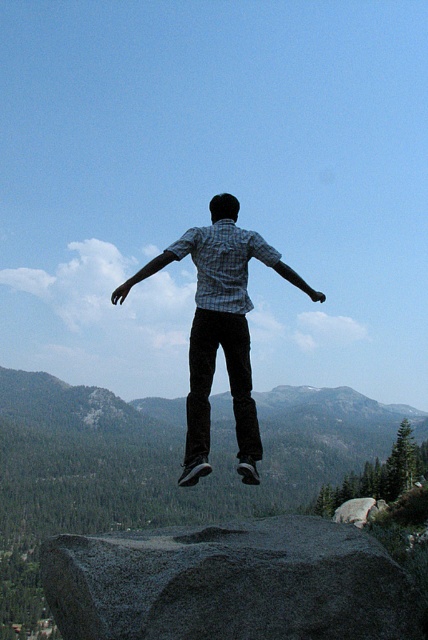
Looking at this image, you are a photographer aiming to capture the person midair. Based on the scene, which object is positioned closer to your camera lens when focusing on the person jumping off the gray rough rock at center and the checkered shirt at center?

The gray rough rock at center is closer to the viewer than the checkered shirt at center, so the gray rough rock at center would be closer to the camera lens when focusing on the person jumping.